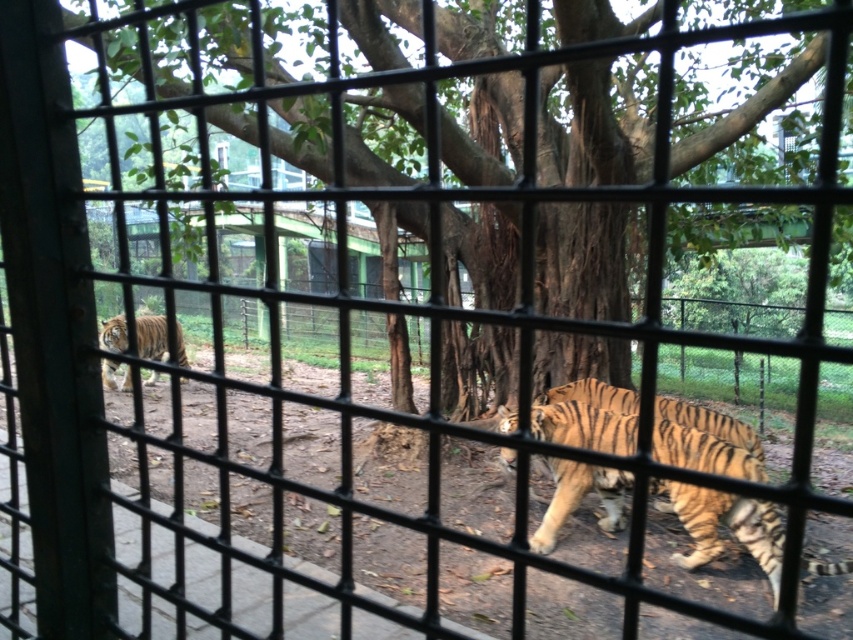
Question: Does orange striped tiger at center appear on the left side of orange striped tiger at left?

Choices:
 (A) no
 (B) yes

Answer: (A)

Question: Considering the relative positions of orange striped tiger at center and orange striped tiger at left in the image provided, where is orange striped tiger at center located with respect to orange striped tiger at left?

Choices:
 (A) above
 (B) below

Answer: (B)

Question: Which point is farther from the camera taking this photo?

Choices:
 (A) (148, 355)
 (B) (552, 538)

Answer: (A)

Question: Which object appears closest to the camera in this image?

Choices:
 (A) orange striped tiger at center
 (B) orange striped tiger at left

Answer: (A)

Question: Which object is farther from the camera taking this photo?

Choices:
 (A) orange striped tiger at center
 (B) orange striped tiger at left

Answer: (B)

Question: Can you confirm if orange striped tiger at center is positioned below orange striped tiger at left?

Choices:
 (A) no
 (B) yes

Answer: (B)